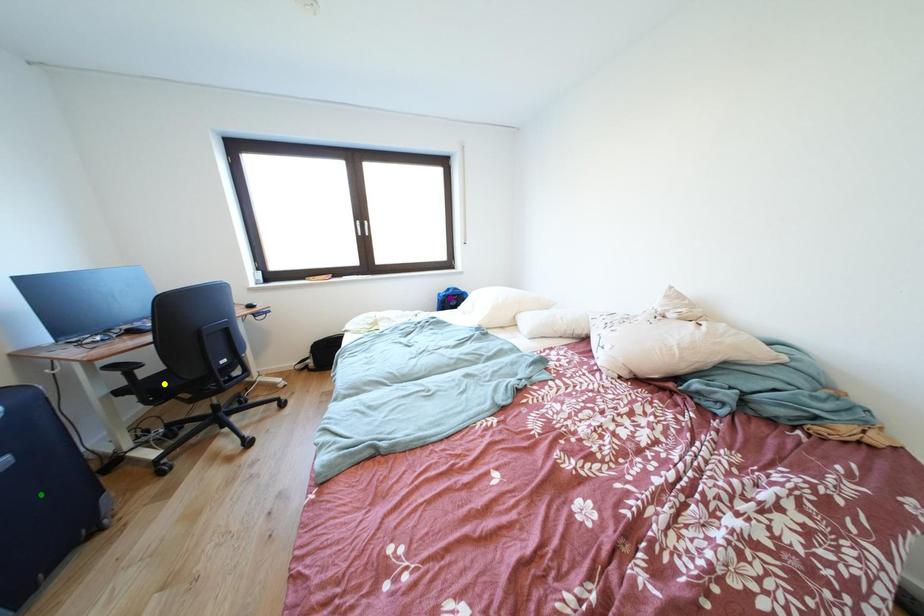
Order these from nearest to farthest:
1. green point
2. yellow point
3. purple point

purple point → yellow point → green point